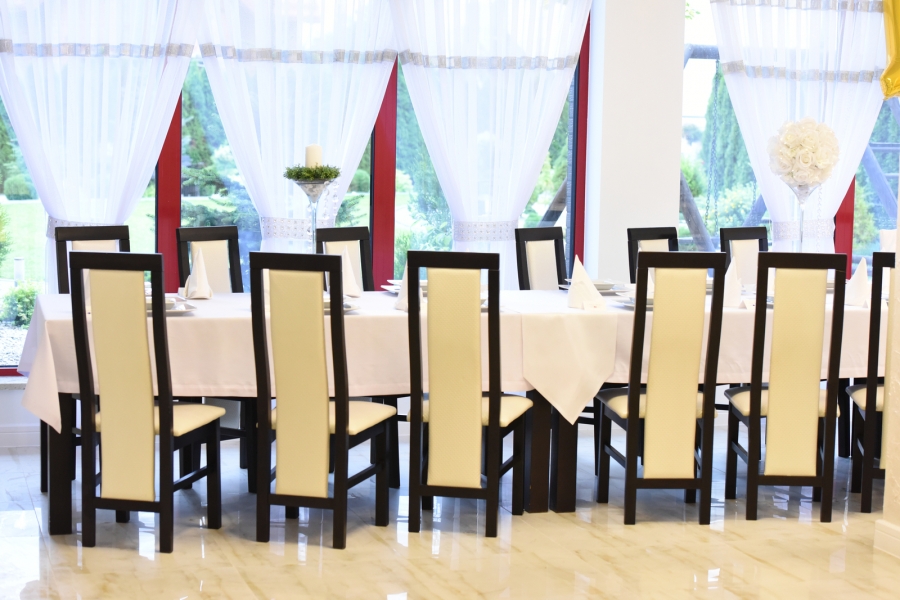
Where is `seat cushions`? The width and height of the screenshot is (900, 600). seat cushions is located at coordinates (202, 411), (369, 411), (519, 410), (617, 408), (745, 409), (860, 394).